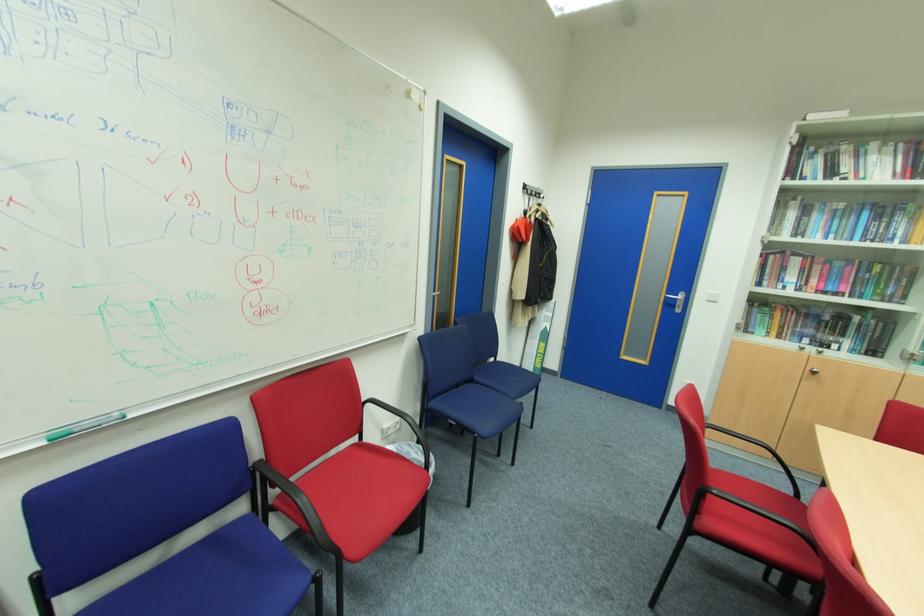
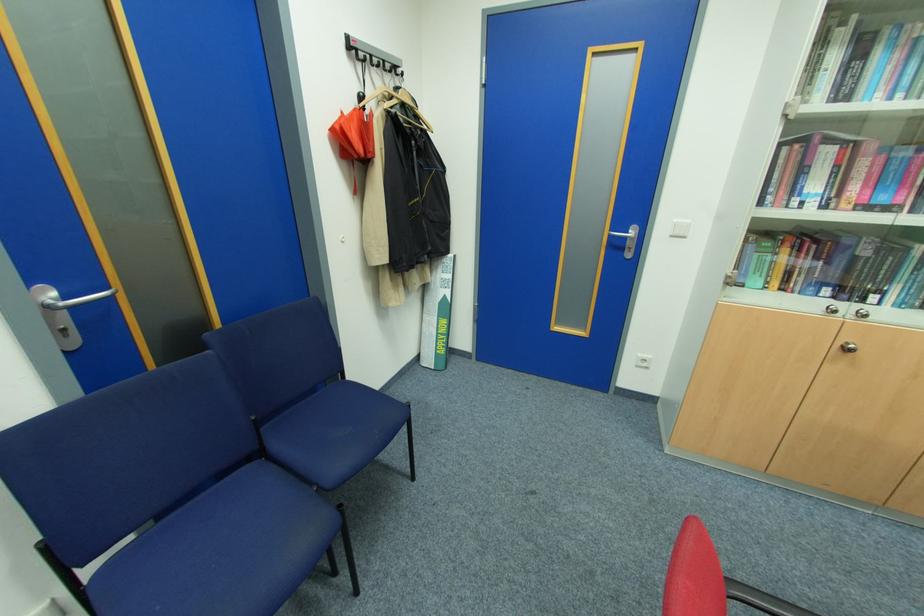
Find the pixel in the second image that matches point 550,328 in the first image.

(448, 296)